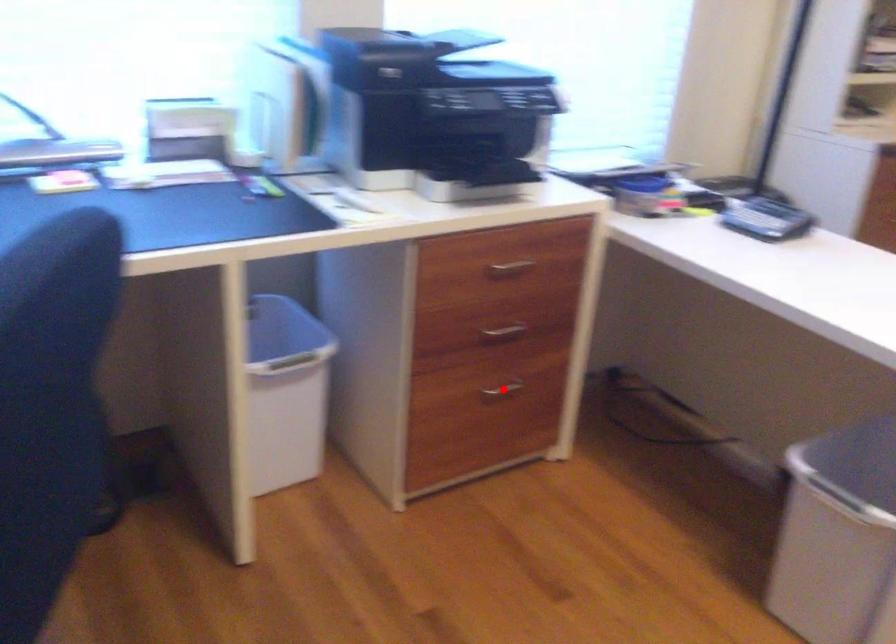
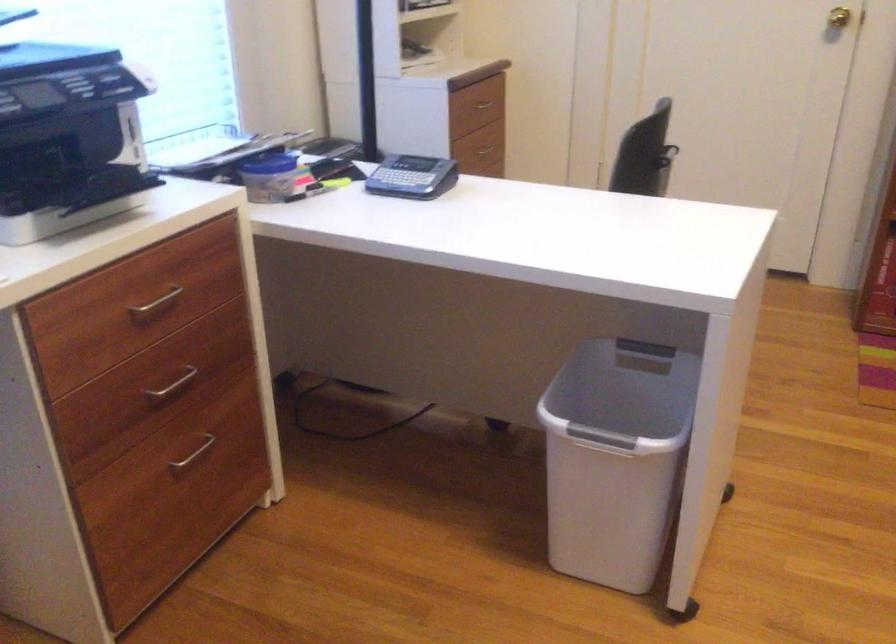
Question: A red point is marked in image1. In image2, is the corresponding 3D point closer to the camera or farther? Reply with the corresponding letter.

Choices:
 (A) The corresponding 3D point is closer.
 (B) The corresponding 3D point is farther.

Answer: (A)